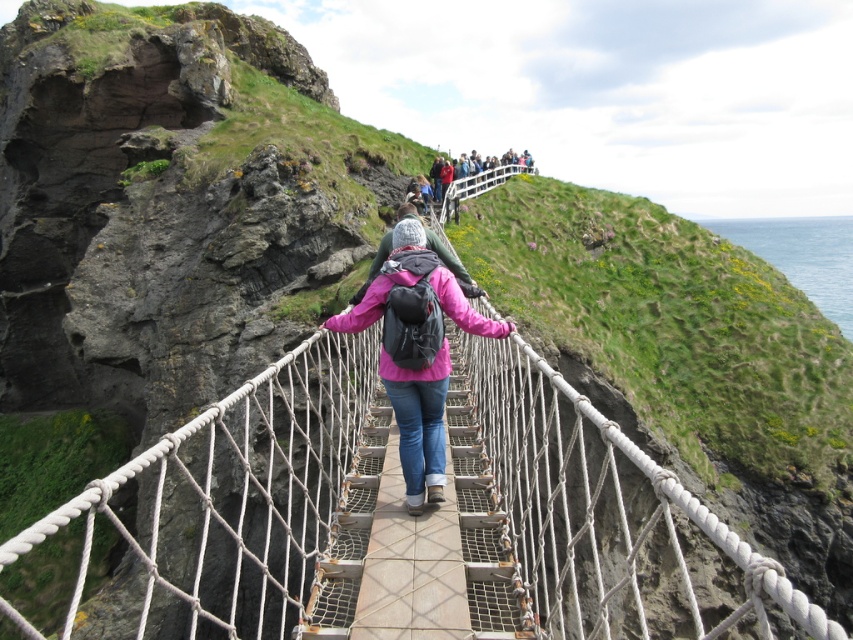
You are a hiker carrying a large backpack and need to cross the suspension bridge. You notice a pink matte jacket at center and a matte black backpack at upper center in the scene. Which item appears smaller in size?

The pink matte jacket at center appears smaller in size compared to the matte black backpack at upper center.

You are standing on the suspension bridge and need to place a 7.31 feet long wooden plank between the wooden planks at center and the pink matte jacket at center. Will the wooden plank fit exactly between them?

The wooden planks at center is 7.31 feet from the pink matte jacket at center, so a 7.31 feet long wooden plank would fit exactly between them.